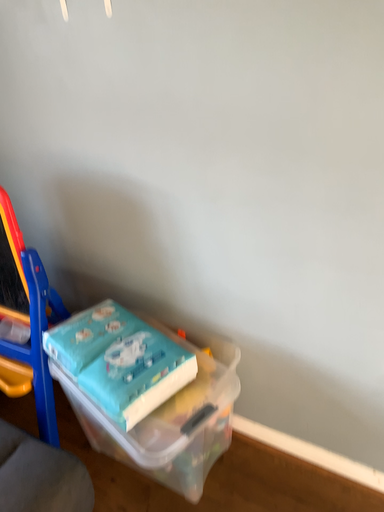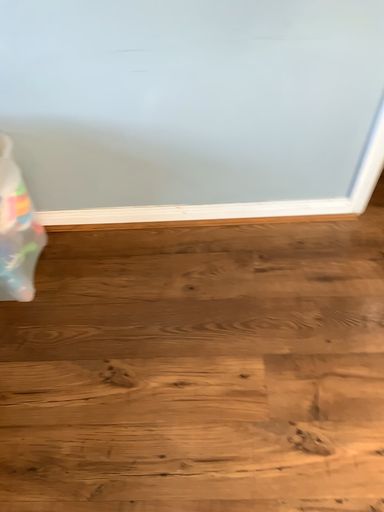
Question: How did the camera likely rotate when shooting the video?

Choices:
 (A) rotated downward
 (B) rotated upward

Answer: (A)